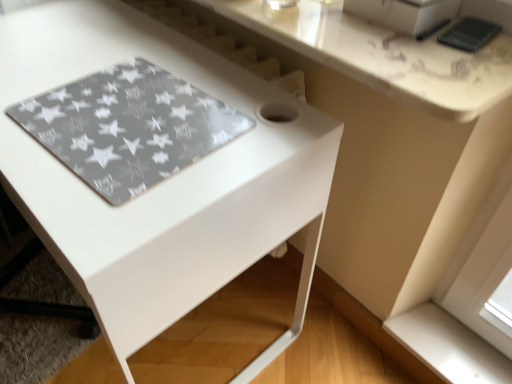
I want to click on free point to the left of black matte phone at upper right, so click(375, 40).